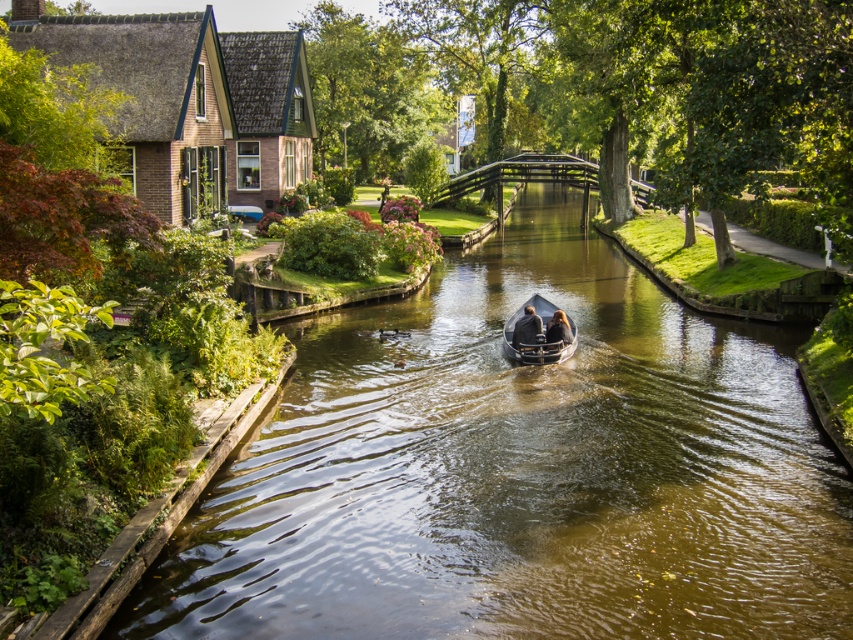
You are a visitor standing on the small bridge on the right bank of the canal. You see the metallic gray boat at center and the smooth black boat at center. Which boat is closer to you?

The metallic gray boat at center is closer to you because it is in front of the smooth black boat at center.

You are standing at point (537, 330) and want to walk to point (521, 307). Which direction should you face to move towards your destination?

You should face backward because point (521, 307) is behind point (537, 330).

You are standing at the point marked as point (686, 467) in the canal scene. If you want to take a photo of the entire canal and the surrounding areas, would your current position allow you to capture the whole scene without moving? Please explain your reasoning based on the distance between you and the camera.

The distance between you at point (686, 467) and the camera is 10.44 meters. Since the camera is positioned 10.44 meters away from you, you might need to move closer or adjust your angle to ensure the entire canal and surrounding areas are captured in the photo.